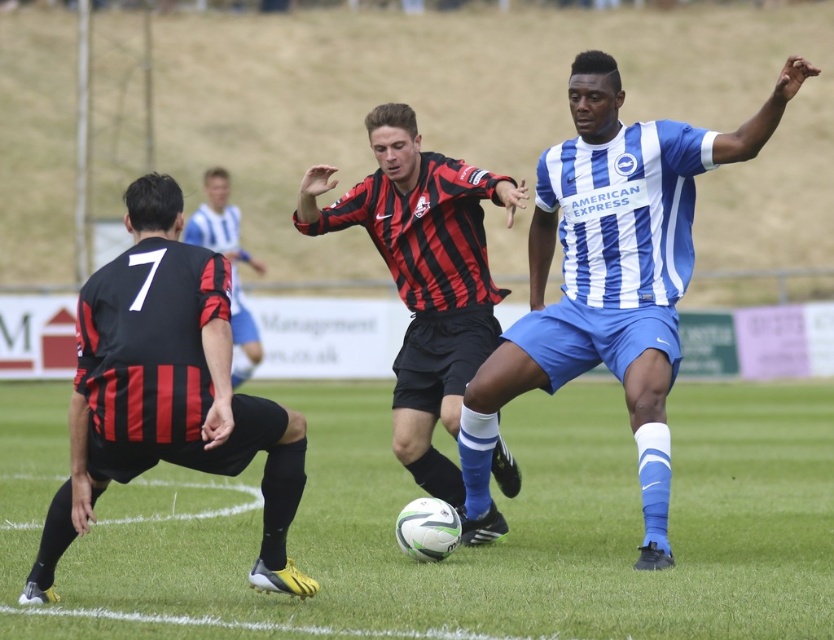
Who is higher up, blue striped jersey at center or black matte jersey at left?

blue striped jersey at center is higher up.

Locate an element on the screen. Image resolution: width=834 pixels, height=640 pixels. blue striped jersey at center is located at coordinates (610, 275).

Find the location of a particular element. The height and width of the screenshot is (640, 834). blue striped jersey at center is located at coordinates (610, 275).

Locate an element on the screen. The width and height of the screenshot is (834, 640). blue striped jersey at center is located at coordinates (610, 275).

Between point (152, 336) and point (245, 349), which one is positioned behind?

Positioned behind is point (245, 349).

Can you confirm if black matte jersey at left is positioned above black striped jersey at center?

Incorrect, black matte jersey at left is not positioned above black striped jersey at center.

Does point (83, 355) come farther from viewer compared to point (249, 368)?

No.

The height and width of the screenshot is (640, 834). I want to click on black matte jersey at left, so click(167, 390).

I want to click on green grass at center, so click(x=495, y=541).

Can you confirm if green grass at center is positioned to the left of blue striped jersey at center?

Correct, you'll find green grass at center to the left of blue striped jersey at center.

Describe the element at coordinates (495, 541) in the screenshot. Image resolution: width=834 pixels, height=640 pixels. I see `green grass at center` at that location.

Where is `green grass at center`? This screenshot has width=834, height=640. green grass at center is located at coordinates click(x=495, y=541).